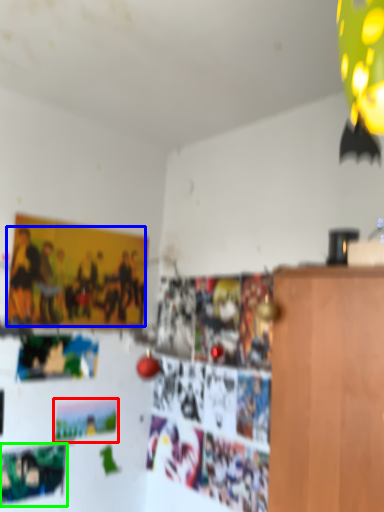
Question: Which object is the closest to the postcard (highlighted by a red box)? Choose among these: person (highlighted by a blue box) or poster (highlighted by a green box).

Choices:
 (A) person
 (B) poster

Answer: (B)